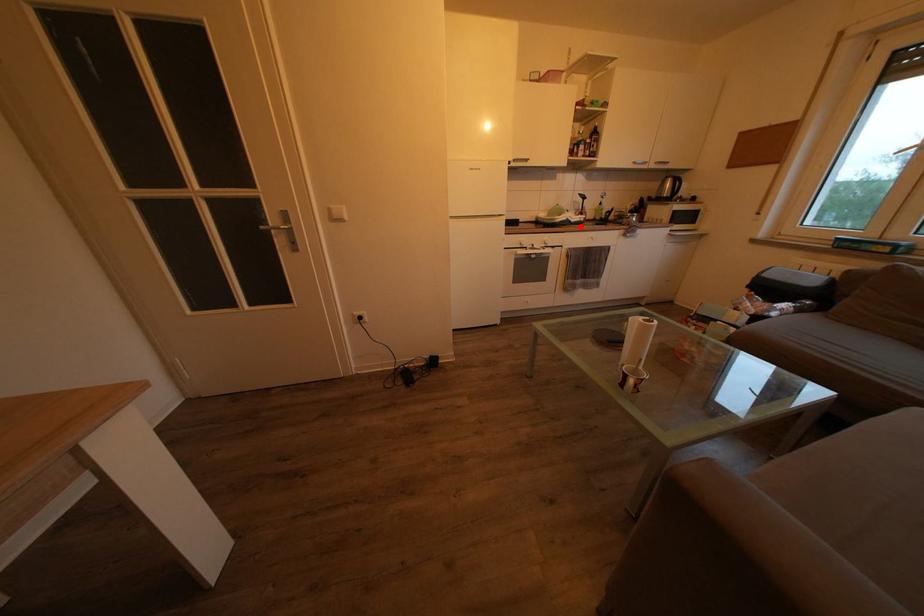
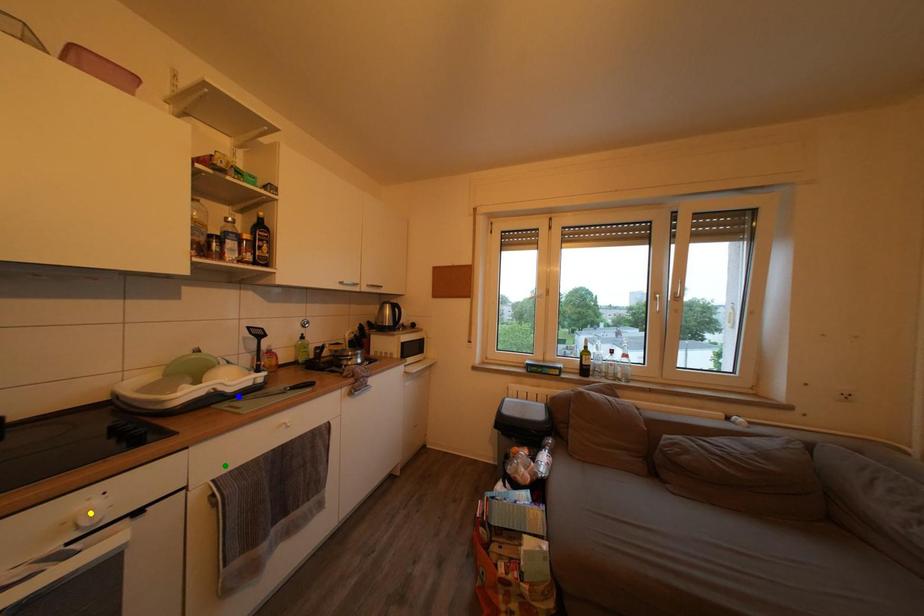
Question: I am providing you with two images of the same scene from different viewpoints. A red point is marked on the first image. You are given multiple points on the second image. In image 2, which mark is for the same physical point as the one in image 1?

Choices:
 (A) blue point
 (B) green point
 (C) yellow point

Answer: (A)